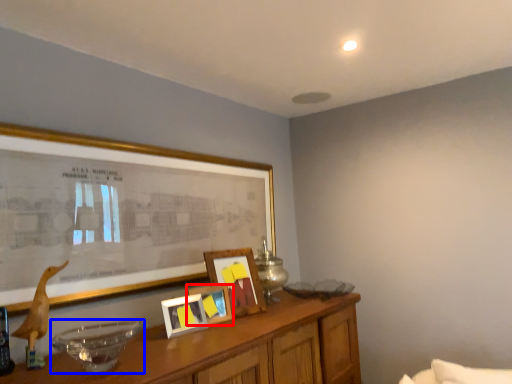
Question: Which of the following is the closest to the observer, picture frame (highlighted by a red box) or glass bowl (highlighted by a blue box)?

Choices:
 (A) picture frame
 (B) glass bowl

Answer: (B)